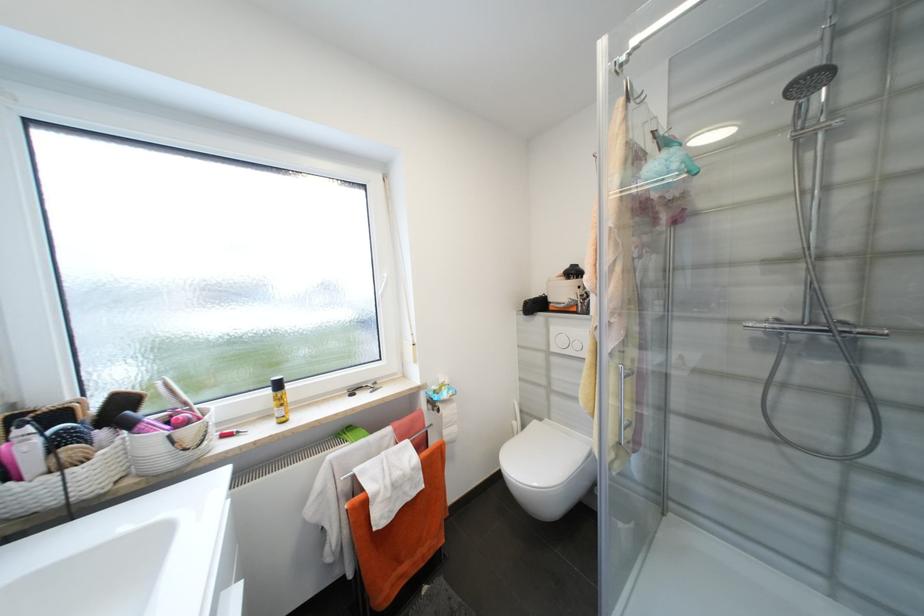
The image size is (924, 616). Describe the element at coordinates (362, 387) in the screenshot. I see `the metal window latch` at that location.